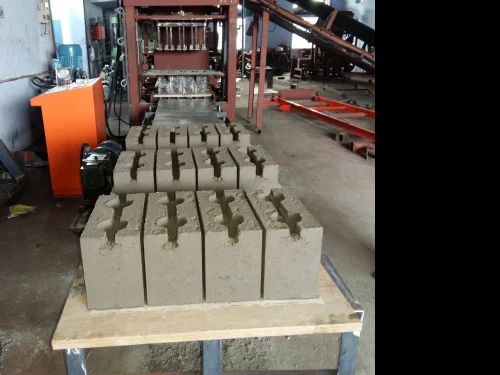
Identify the location of space to left of table. This screenshot has height=375, width=500. (47, 268).